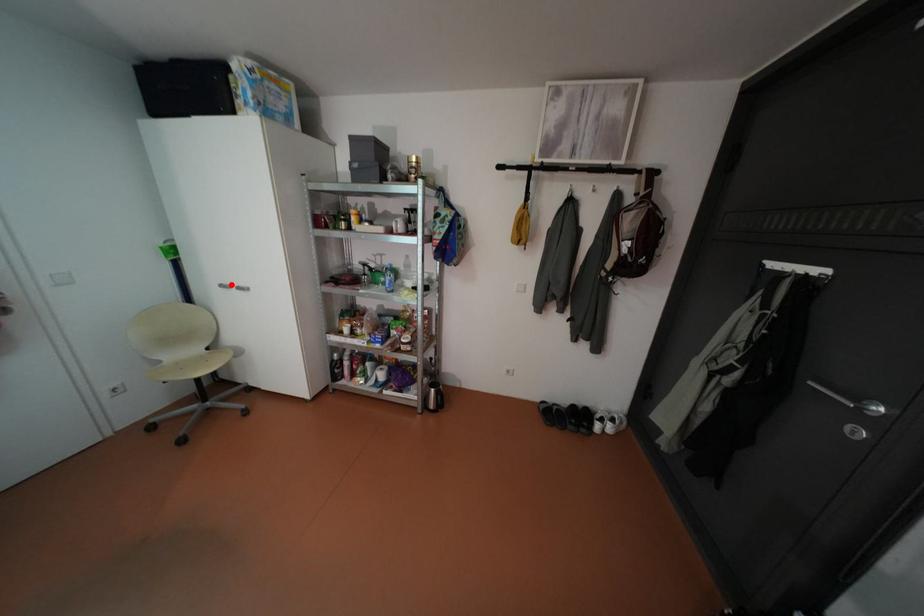
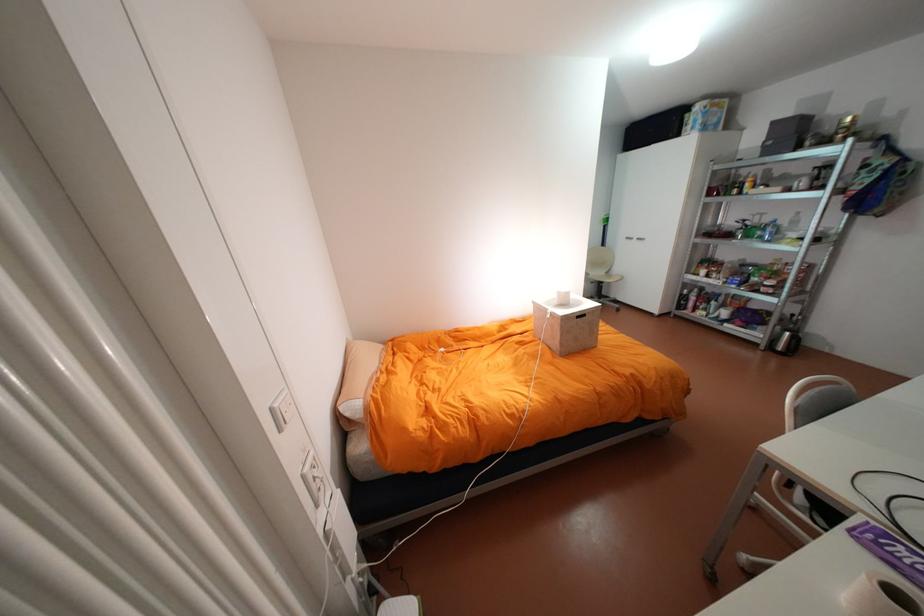
Question: A red point is marked in image1. In image2, is the corresponding 3D point closer to the camera or farther? Reply with the corresponding letter.

Choices:
 (A) The corresponding 3D point is closer.
 (B) The corresponding 3D point is farther.

Answer: (A)